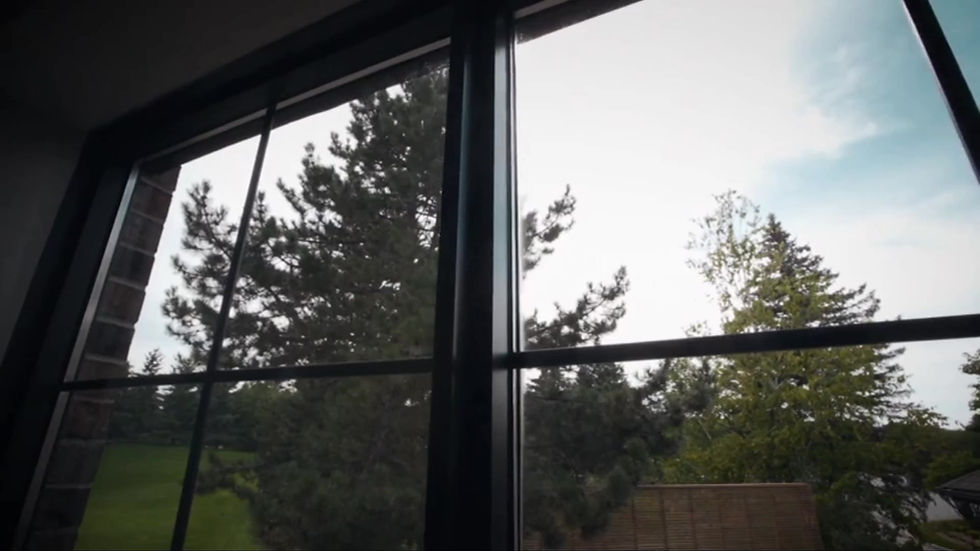
You are a GUI agent. You are given a task and a screenshot of the screen. Output one action in this format:
    pyautogui.click(x=<x>, y=<y>)
    Task: Click on the window trim
    The height and width of the screenshot is (551, 980).
    Given the screenshot: What is the action you would take?
    pyautogui.click(x=78, y=252), pyautogui.click(x=189, y=124)